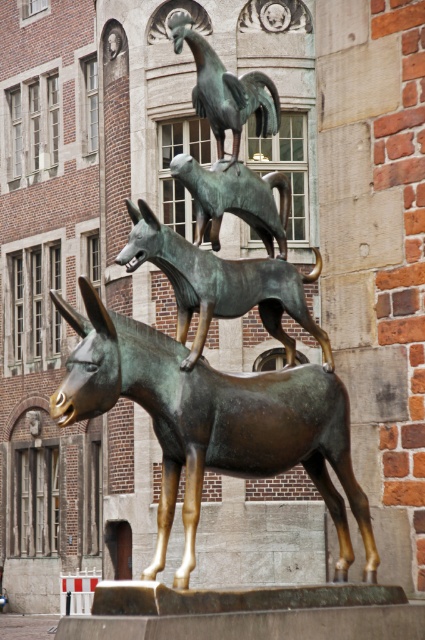
Looking at this image, looking at the bronze sculpture in front of the historic building, which object, the bronze dog at center or the bronze rooster at upper center, has a greater width?

The bronze dog at center is wider than the bronze rooster at upper center according to the description.

You are standing in front of the historic building and want to place a new plaque between the bronze donkey at center and the historic building. The plaque requires a minimum of 40 meters of space between it and the building. Is the current distance sufficient?

The bronze donkey at center is 39.46 meters away from the historic building. Since the required minimum distance is 40 meters, the current distance of 39.46 meters is insufficient. The plaque cannot be placed as it does not meet the required spacing.

You are an art student analyzing the bronze sculpture in front of the historic building. You notice the bronze dog at center and the bronze rooster at upper center. Which of these two objects is closer to you as you face the sculpture?

The bronze dog at center is closer to you because it is positioned in front of the bronze rooster at upper center.